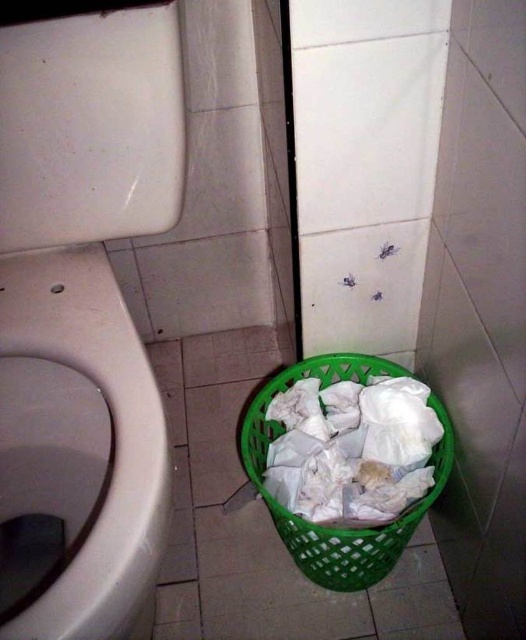
Question: Is white glossy toilet bowl at left further to the viewer compared to green plastic basket at lower center?

Choices:
 (A) no
 (B) yes

Answer: (A)

Question: Does white glossy toilet bowl at left appear over green plastic basket at lower center?

Choices:
 (A) yes
 (B) no

Answer: (A)

Question: Which point is farther to the camera?

Choices:
 (A) (92, 536)
 (B) (372, 577)

Answer: (B)

Question: Observing the image, what is the correct spatial positioning of white glossy toilet bowl at left in reference to green plastic basket at lower center?

Choices:
 (A) right
 (B) left

Answer: (B)